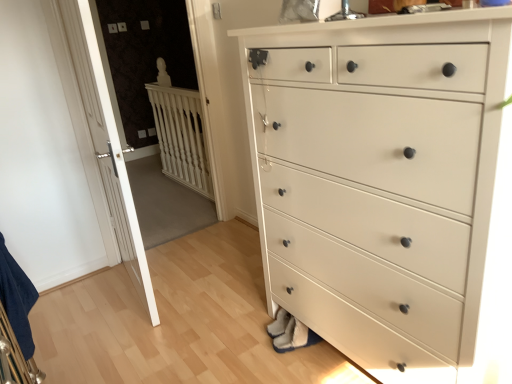
Question: Is white painted wood chest of drawers at center facing towards white wooden door at left?

Choices:
 (A) yes
 (B) no

Answer: (B)

Question: Is white painted wood chest of drawers at center positioned behind white wooden door at left?

Choices:
 (A) yes
 (B) no

Answer: (B)

Question: Can you confirm if white painted wood chest of drawers at center is smaller than white wooden door at left?

Choices:
 (A) yes
 (B) no

Answer: (B)

Question: From a real-world perspective, is white painted wood chest of drawers at center physically above white wooden door at left?

Choices:
 (A) no
 (B) yes

Answer: (A)

Question: From the image's perspective, is white painted wood chest of drawers at center beneath white wooden door at left?

Choices:
 (A) no
 (B) yes

Answer: (B)

Question: Considering the positions of white wooden door at left and white wood balustrade at upper left in the image, is white wooden door at left bigger or smaller than white wood balustrade at upper left?

Choices:
 (A) small
 (B) big

Answer: (B)

Question: Do you think white wooden door at left is within white wood balustrade at upper left, or outside of it?

Choices:
 (A) outside
 (B) inside

Answer: (A)

Question: From the image's perspective, is white wooden door at left above or below white wood balustrade at upper left?

Choices:
 (A) below
 (B) above

Answer: (A)

Question: Is point (126, 238) positioned closer to the camera than point (161, 59)?

Choices:
 (A) closer
 (B) farther

Answer: (A)

Question: Is point (199, 185) positioned closer to the camera than point (100, 185)?

Choices:
 (A) closer
 (B) farther

Answer: (B)

Question: Looking at the image, does white wood balustrade at upper left seem bigger or smaller compared to white wooden door at left?

Choices:
 (A) big
 (B) small

Answer: (B)

Question: Relative to white wooden door at left, is white wood balustrade at upper left in front or behind?

Choices:
 (A) front
 (B) behind

Answer: (B)

Question: From the image's perspective, is white wood balustrade at upper left located above or below white wooden door at left?

Choices:
 (A) above
 (B) below

Answer: (A)

Question: From the image's perspective, is white wooden door at left positioned above or below white painted wood chest of drawers at center?

Choices:
 (A) above
 (B) below

Answer: (A)

Question: Considering the positions of white wooden door at left and white painted wood chest of drawers at center in the image, is white wooden door at left wider or thinner than white painted wood chest of drawers at center?

Choices:
 (A) thin
 (B) wide

Answer: (A)